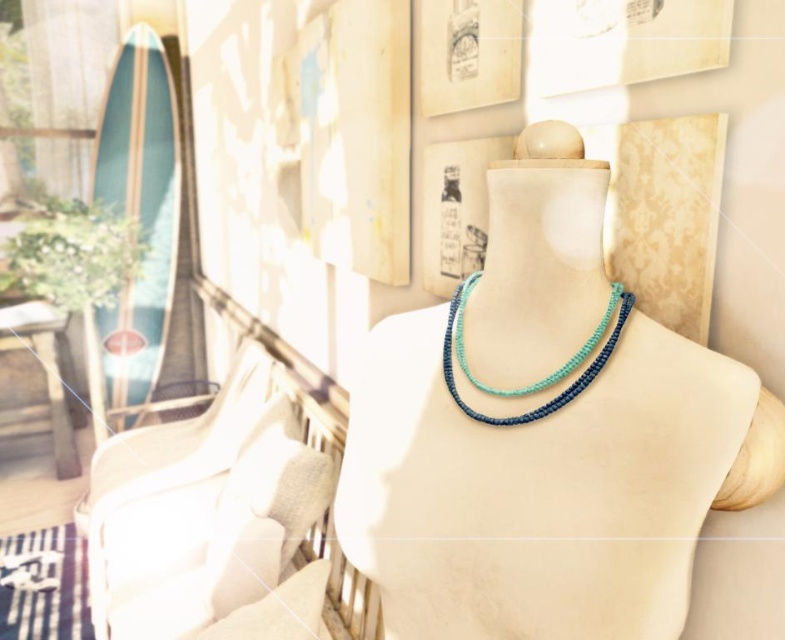
Does teal beaded necklace at center have a greater height compared to teal woven necklace at center?

Indeed, teal beaded necklace at center has a greater height compared to teal woven necklace at center.

Locate an element on the screen. This screenshot has width=785, height=640. teal beaded necklace at center is located at coordinates (543, 435).